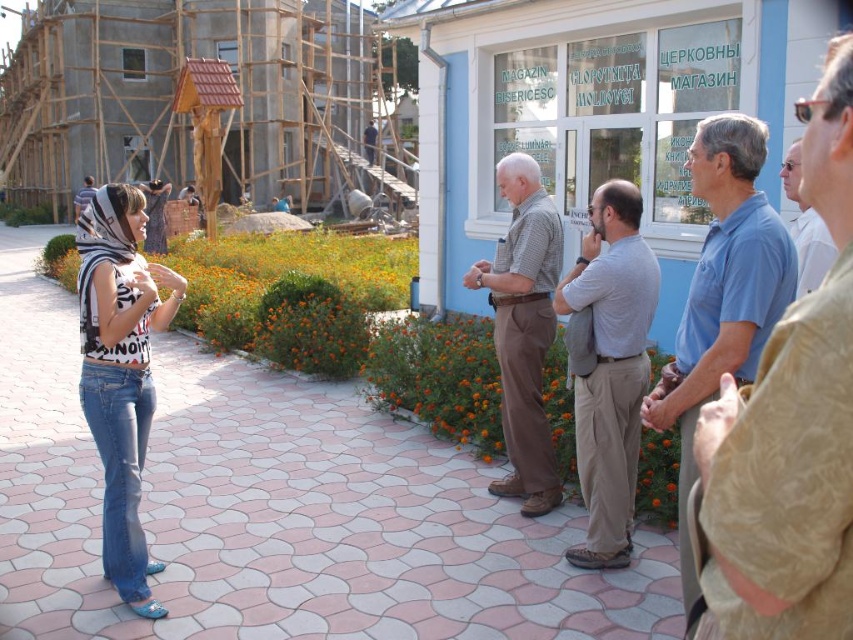
Does denim jeans at left have a lesser width compared to gray cotton shirt at center?

No.

Is point (132, 458) positioned behind point (611, 276)?

No, it is in front of (611, 276).

Which is in front, point (117, 202) or point (585, 564)?

Positioned in front is point (117, 202).

At what (x,y) coordinates should I click in order to perform the action: click on denim jeans at left. Please return your answer as a coordinate pair (x, y). The height and width of the screenshot is (640, 853). Looking at the image, I should click on pos(120,372).

Is point (671, 404) less distant than point (820, 234)?

Yes, point (671, 404) is closer to viewer.

Between blue cotton shirt at right and white shirt at right, which one has less height?

white shirt at right

Does point (757, 209) lie behind point (798, 252)?

No, it is not.

Where is `blue cotton shirt at right`? blue cotton shirt at right is located at coordinates (722, 294).

Does blue shirt at right appear over denim jeans at left?

Correct, blue shirt at right is located above denim jeans at left.

Is blue shirt at right to the right of denim jeans at left from the viewer's perspective?

Correct, you'll find blue shirt at right to the right of denim jeans at left.

The width and height of the screenshot is (853, 640). Identify the location of blue shirt at right. coord(788,429).